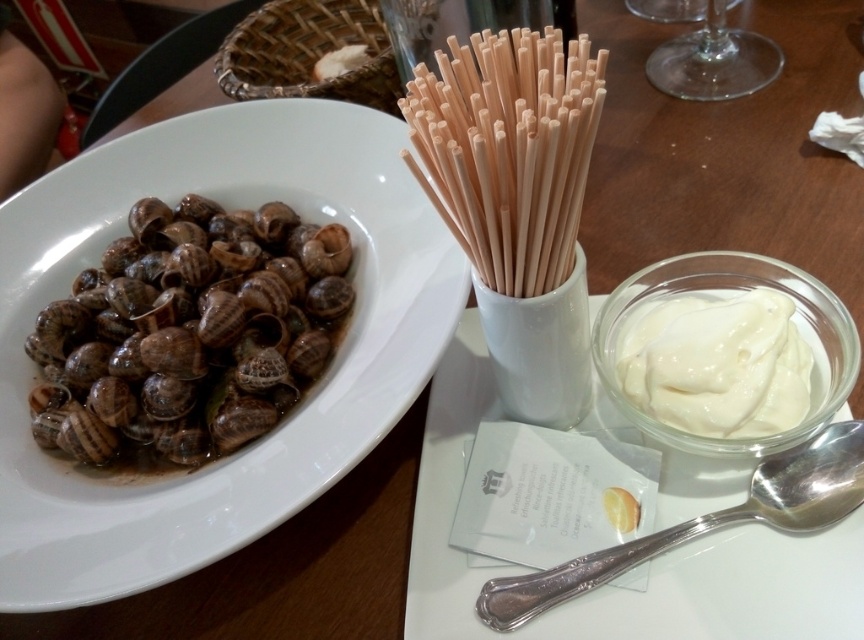
You are a diner at the table and want to reach the white creamy sauce at right. Based on your current position, which direction should you move to get it?

The white creamy sauce at right is located at point (718, 365), so you should move to the right and slightly forward to reach it.

You are a guest at a dinner party and want to reach for the silver metallic spoon at upper right without moving the matte ceramic platter at left. Is this possible?

The matte ceramic platter at left is in front of the silver metallic spoon at upper right, so you can reach the spoon without moving the platter by accessing it from behind the platter.